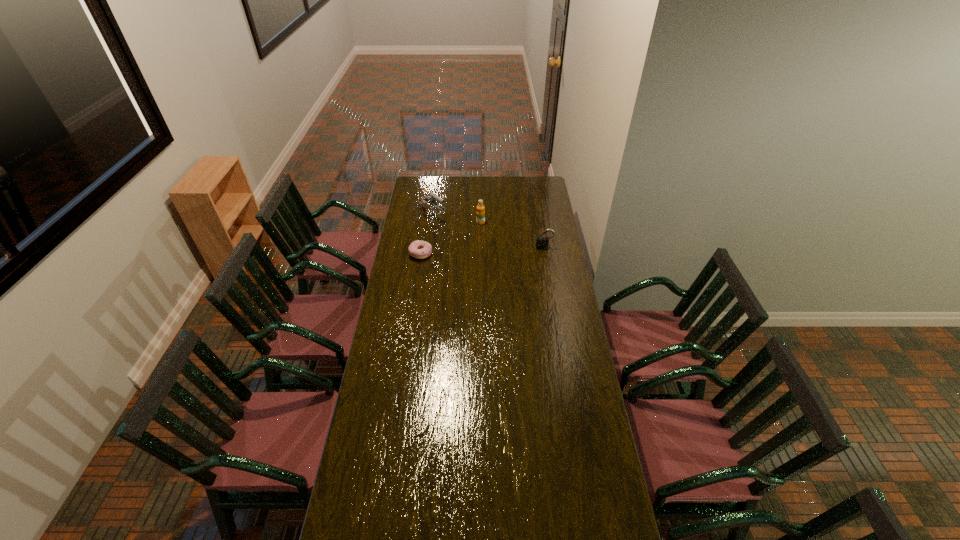
The height and width of the screenshot is (540, 960). I want to click on vacant space at the far right corner of the desktop, so click(536, 181).

Where is `vacant space in between the second object from right to left and the second shortest object`? Image resolution: width=960 pixels, height=540 pixels. vacant space in between the second object from right to left and the second shortest object is located at coordinates (513, 235).

Identify the location of empty space between the orange juice and the doughnut. The image size is (960, 540). (450, 238).

Identify the location of vacant space that is in between the orange juice and the third tallest object. [513, 235].

Locate an element on the screen. This screenshot has width=960, height=540. empty location between the orange juice and the shortest object is located at coordinates (450, 238).

At what (x,y) coordinates should I click in order to perform the action: click on free space between the orange juice and the gun. Please return your answer as a coordinate pair (x, y). The height and width of the screenshot is (540, 960). Looking at the image, I should click on (456, 220).

What are the coordinates of `empty location between the rightmost object and the orange juice` in the screenshot? It's located at (513, 235).

Locate an element on the screen. The height and width of the screenshot is (540, 960). vacant space that is in between the second shortest object and the gun is located at coordinates (488, 232).

The height and width of the screenshot is (540, 960). In order to click on free space between the gun and the third object from left to right in this screenshot , I will do `click(456, 220)`.

Locate an element on the screen. The height and width of the screenshot is (540, 960). empty space between the second object from right to left and the gun is located at coordinates 456,220.